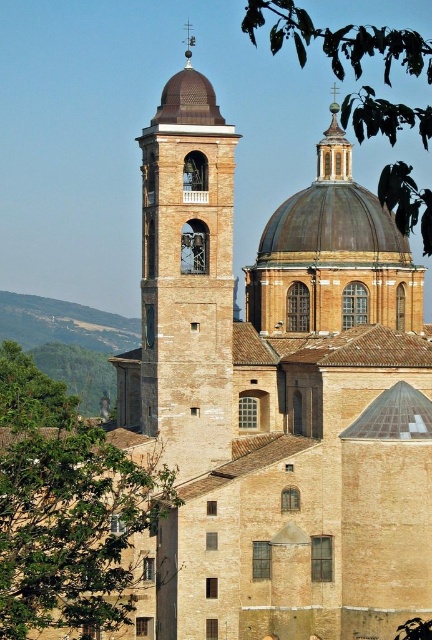
Based on the photo, you are a drone operator tasked with capturing aerial footage of the beige stone bell tower at center and the green leafy tree at upper center. The minimum safe distance between the drone and any object is 50 feet. Can your drone safely film both objects simultaneously without violating the safety protocols?

The beige stone bell tower at center is 51.65 feet from the green leafy tree at upper center. Since the distance between them is greater than the 50 feet safety requirement, the drone can safely film both objects simultaneously while maintaining the required distance.

You are standing in front of the historic church and want to take a photo that includes both the beige stone bell tower at center and the green leafy tree at upper center. Which object should you position closer to the foreground of your camera frame?

The beige stone bell tower at center is further to the viewer than the green leafy tree at upper center, so you should position the beige stone bell tower at center closer to the foreground of your camera frame.